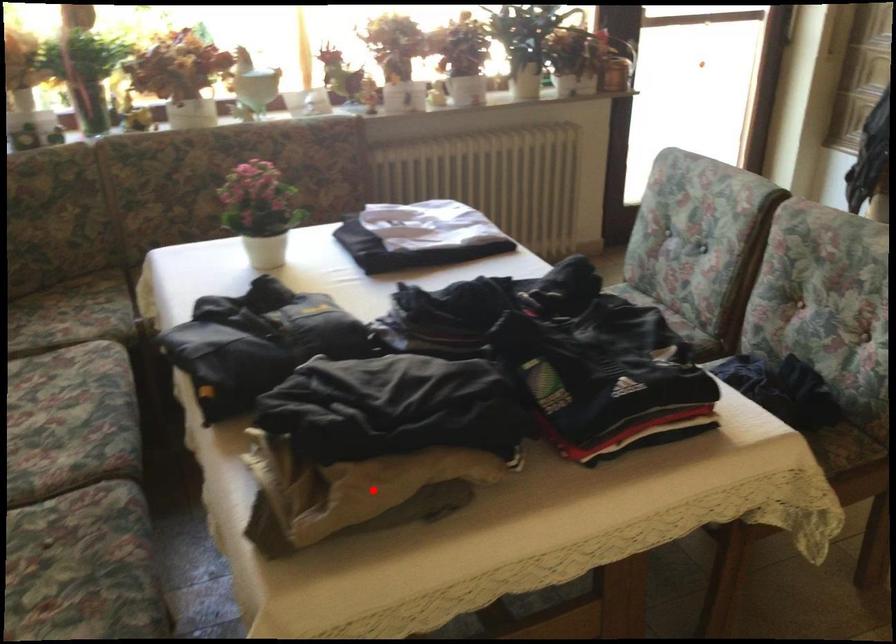
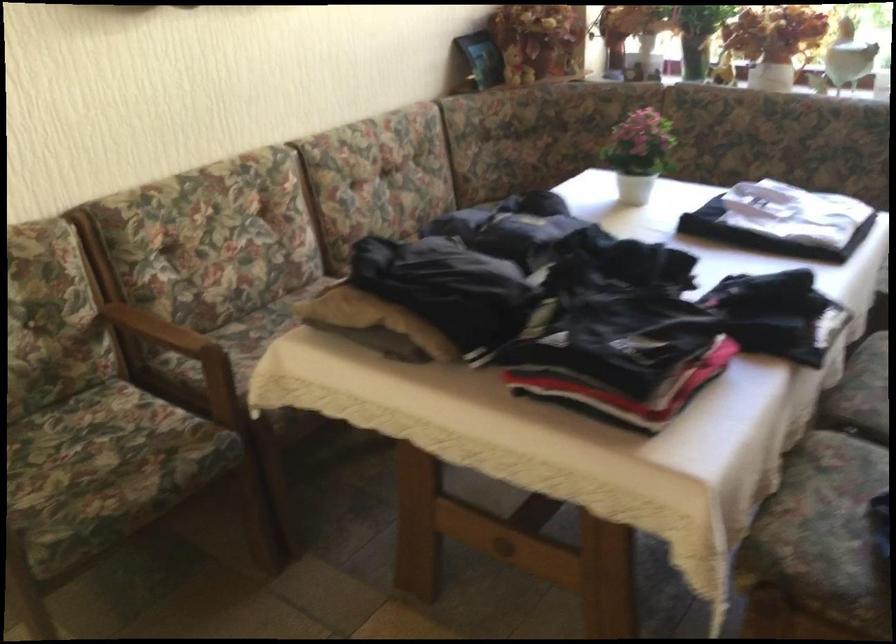
Question: A red point is marked in image1. In image2, is the corresponding 3D point closer to the camera or farther? Reply with the corresponding letter.

Choices:
 (A) The corresponding 3D point is closer.
 (B) The corresponding 3D point is farther.

Answer: (B)